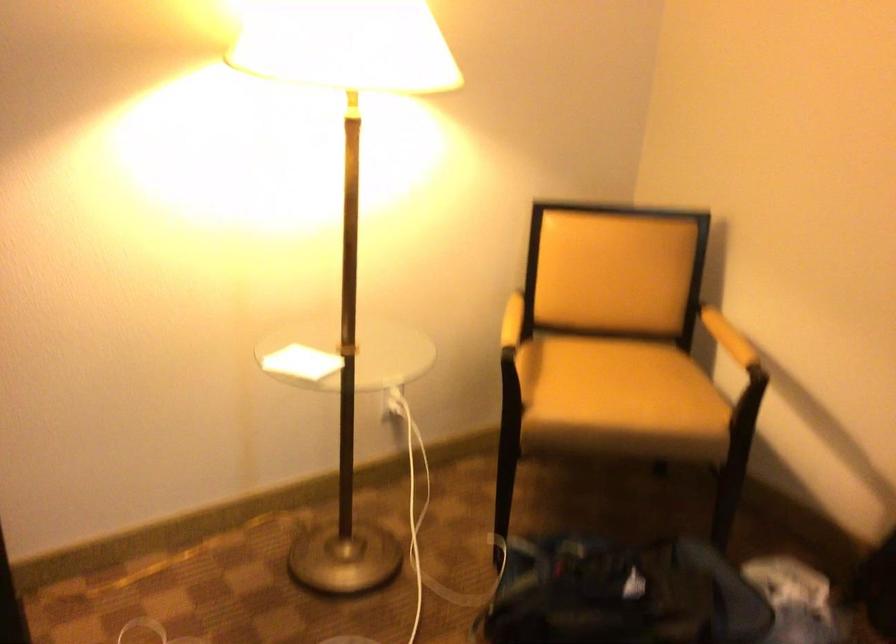
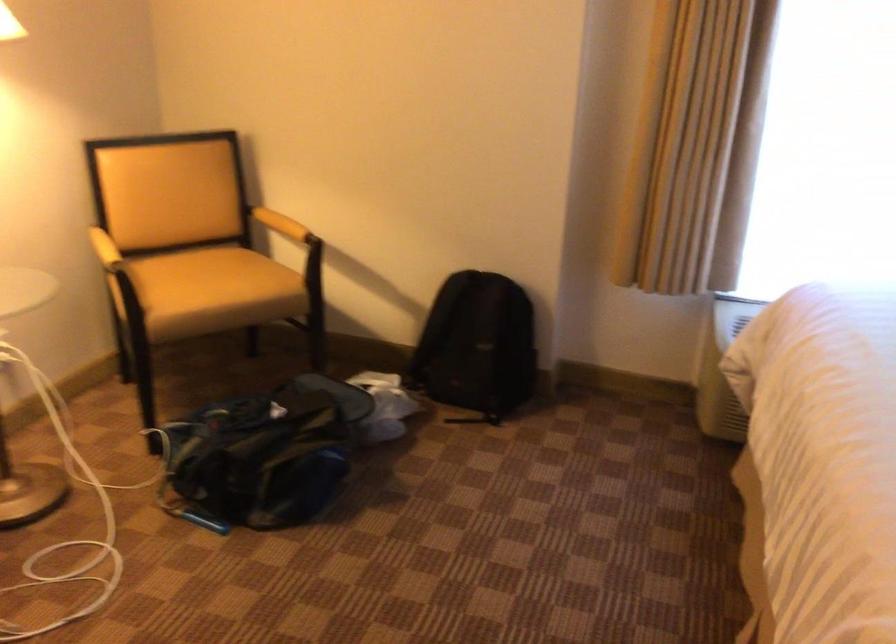
Question: The camera is either moving clockwise (left) or counter-clockwise (right) around the object. The first image is from the beginning of the video and the second image is from the end. Is the camera moving left or right when shooting the video?

Choices:
 (A) Left
 (B) Right

Answer: (A)